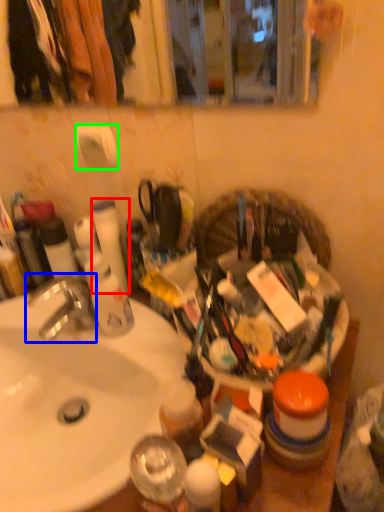
Question: Estimate the real-world distances between objects in this image. Which object is farther from toilet paper (highlighted by a red box), faucet (highlighted by a blue box) or toilet paper (highlighted by a green box)?

Choices:
 (A) faucet
 (B) toilet paper

Answer: (A)